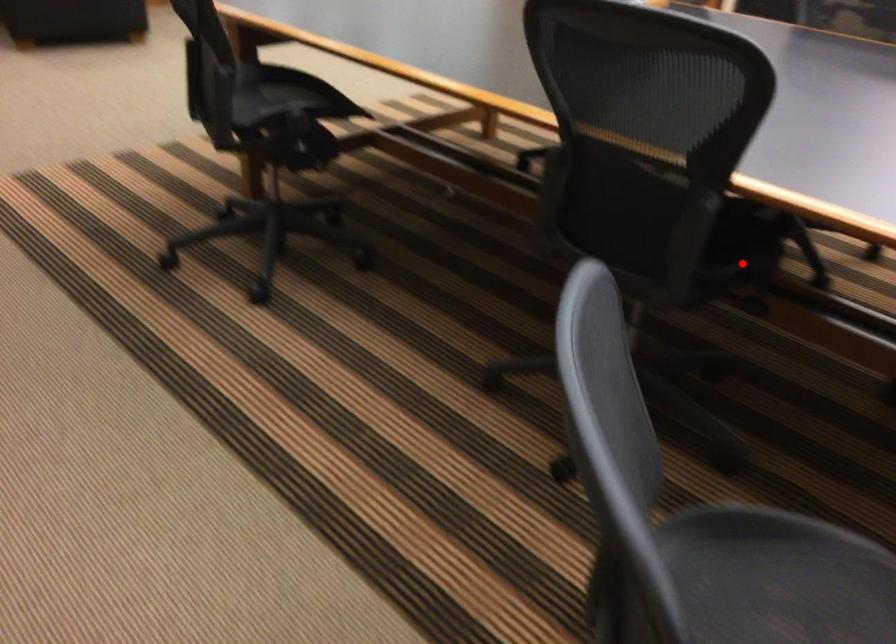
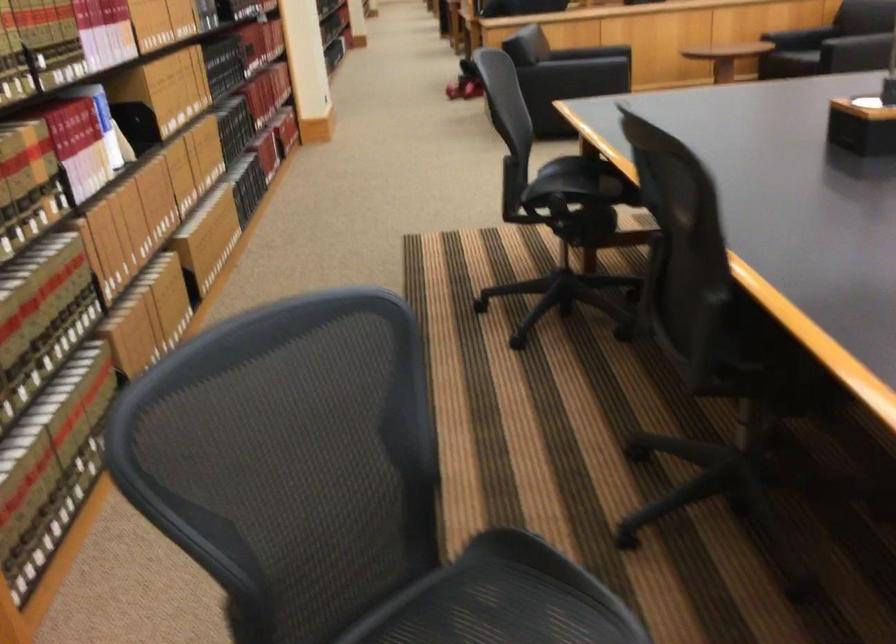
In the second image, find the point that corresponds to the highlighted location in the first image.

(762, 360)